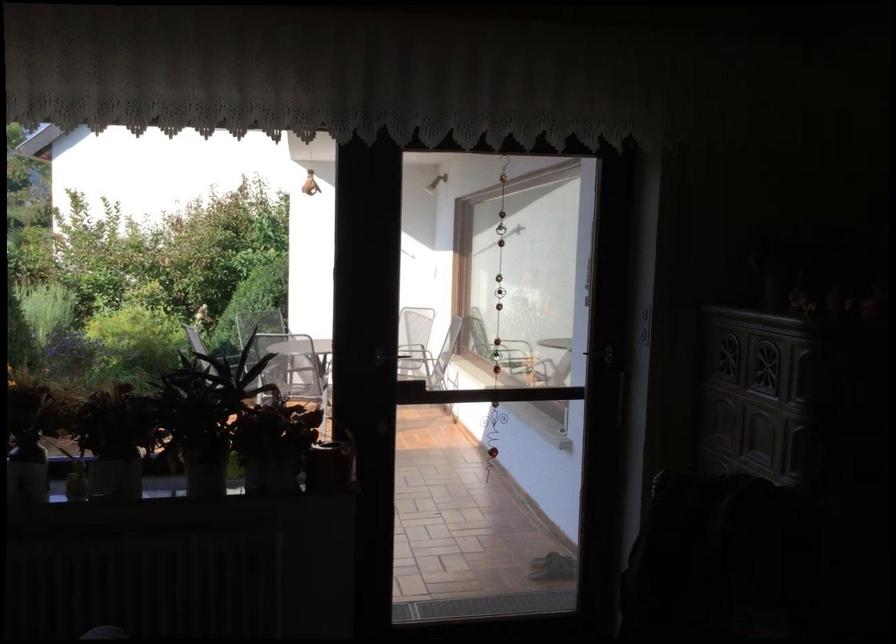
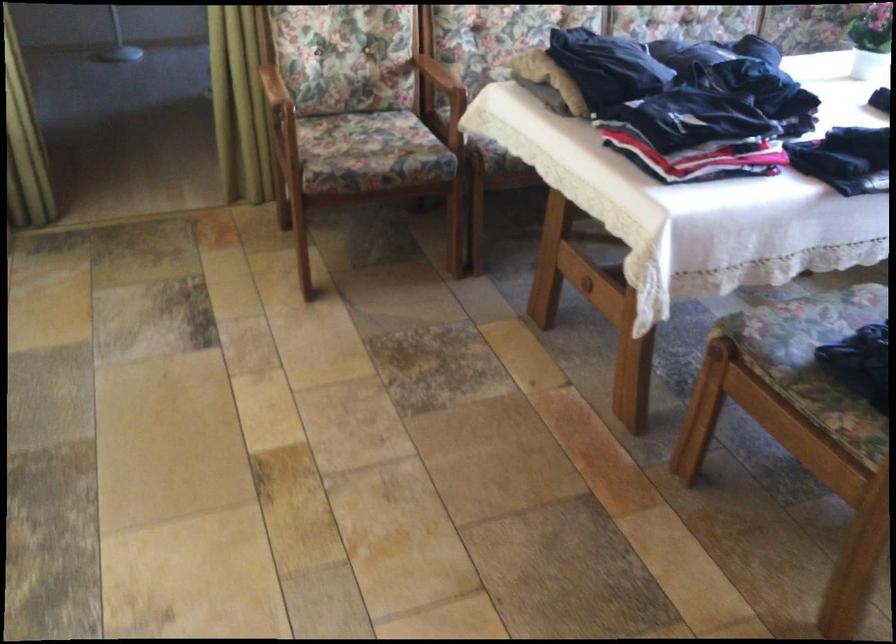
First-person continuous shooting, in which direction is the camera rotating?

The rotation direction of the camera is left-down.